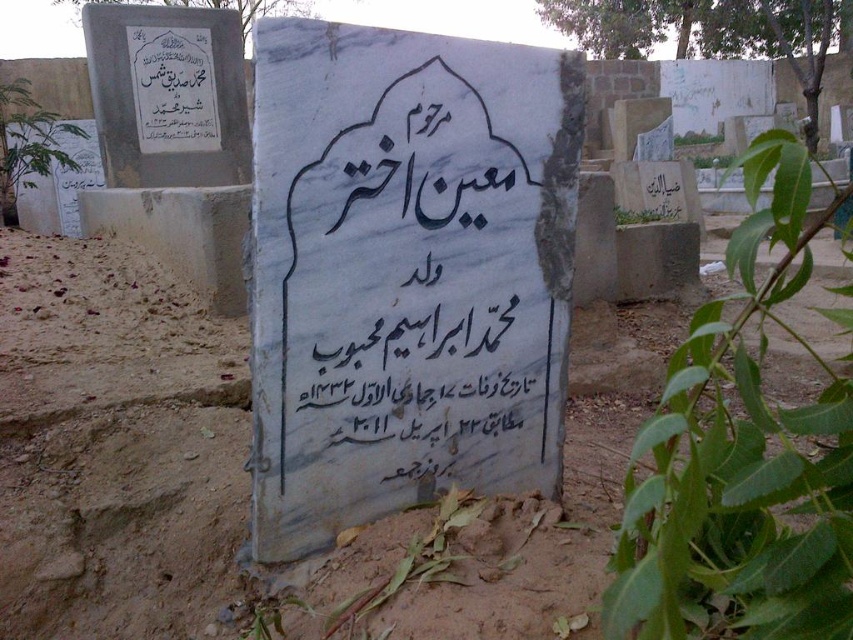
You are standing in the cemetery and want to place a wreath on the brown sandy dirt at center. Can you place it directly in front of the white marble gravestone at center without moving the gravestone?

The white marble gravestone at center is closer to the viewer than the brown sandy dirt at center, so placing the wreath directly in front of the gravestone would require placing it on the sandy dirt behind the gravestone.

You are standing at the point with coordinates (x=405, y=272) in the cemetery scene. What object are you directly positioned at?

You are directly positioned at the white marble gravestone at center, which is represented by the point coordinates (x=405, y=272).

You are a groundskeeper tasked with removing debris from the cemetery. You see the white marble gravestone at center and the brown sandy dirt at center. Which object is positioned higher in the scene?

The white marble gravestone at center is located above the brown sandy dirt at center, so it is positioned higher in the scene.